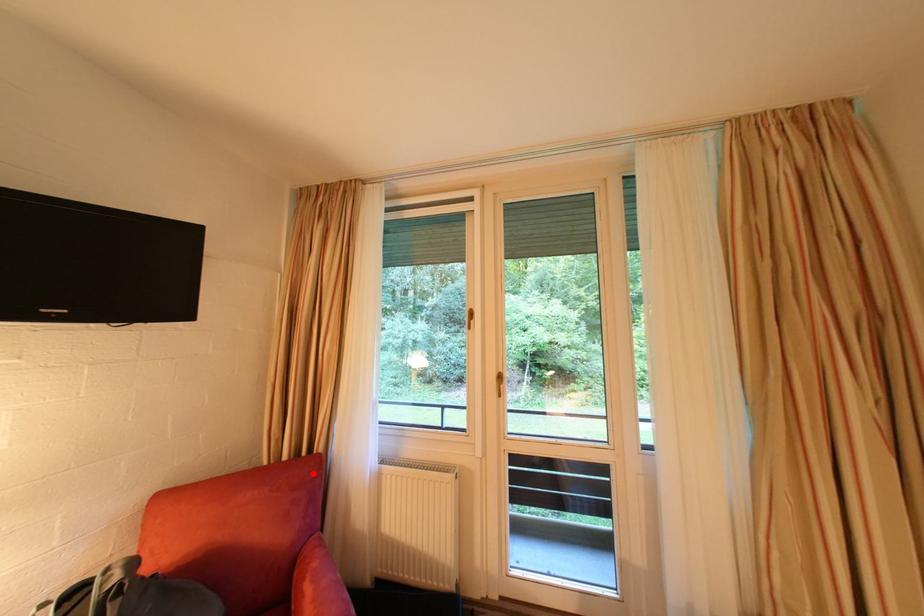
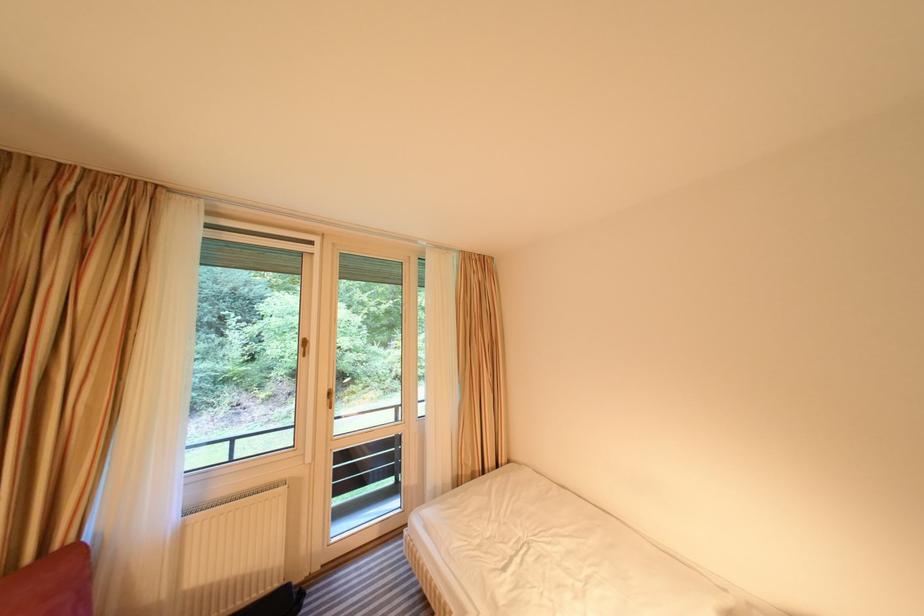
Find the pixel in the second image that matches the highlighted location in the first image.

(57, 578)